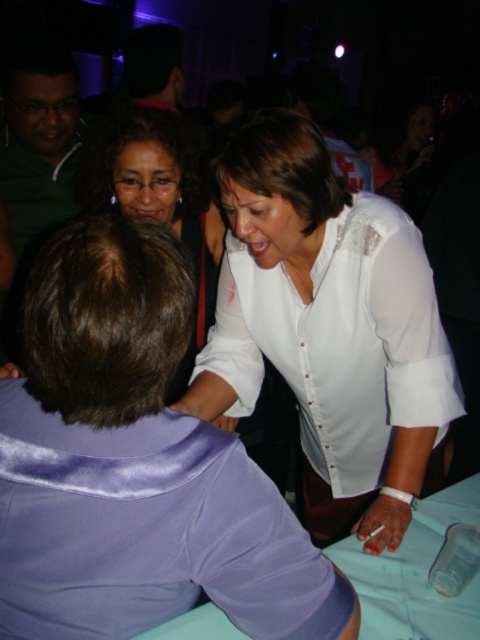
Find the location of `matte black hair at upper center`. matte black hair at upper center is located at coordinates (155, 193).

Which is behind, point (153, 188) or point (455, 548)?

Point (153, 188)

Locate an element on the screen. matte black hair at upper center is located at coordinates (155, 193).

Describe the element at coordinates (328, 330) in the screenshot. I see `white satin blouse at center` at that location.

Find the location of a particular element. The width and height of the screenshot is (480, 640). white satin blouse at center is located at coordinates (328, 330).

This screenshot has width=480, height=640. I want to click on white satin blouse at center, so click(328, 330).

Is matte black hair at upper center shorter than light blue satin tablecloth at lower center?

No, matte black hair at upper center is not shorter than light blue satin tablecloth at lower center.

Is matte black hair at upper center to the right of light blue satin tablecloth at lower center from the viewer's perspective?

In fact, matte black hair at upper center is to the left of light blue satin tablecloth at lower center.

Locate an element on the screen. The width and height of the screenshot is (480, 640). matte black hair at upper center is located at coordinates (155, 193).

Locate an element on the screen. The height and width of the screenshot is (640, 480). matte black hair at upper center is located at coordinates (155, 193).